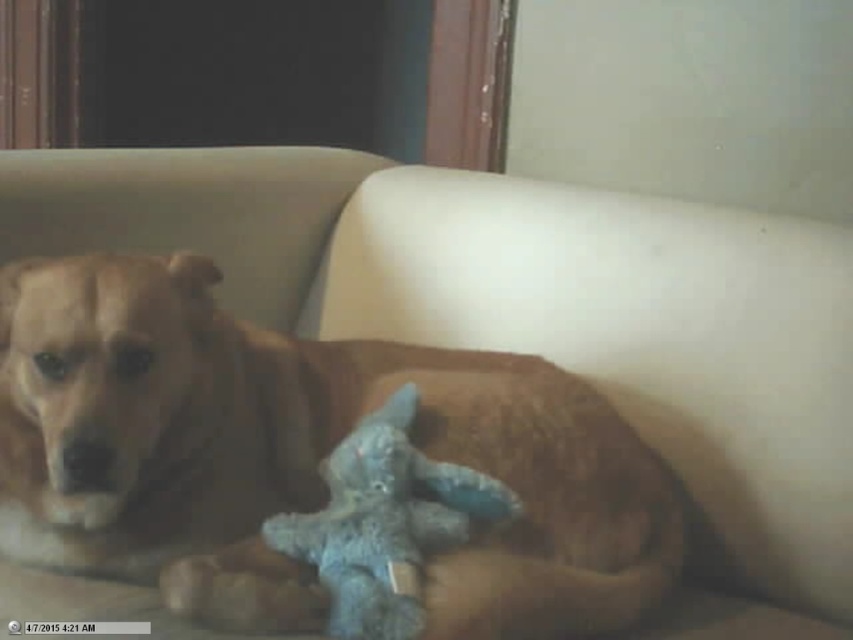
You are a photographer trying to capture a closeup of the blue plush toy at center without the golden brown fur at center blocking the view. Can you move the camera to the side to get a clear shot?

The blue plush toy at center is behind the golden brown fur at center, so moving the camera to the side might allow you to see around the fur and get a clear shot of the blue plush toy at center.

You are an interior designer and want to place a new lamp in the living room where the dog is resting. The lamp must be placed exactly at point (300, 456). What object is currently at that location?

The golden brown fur at center is located at point (300, 456), so the object at that location is the golden brown fur at center.